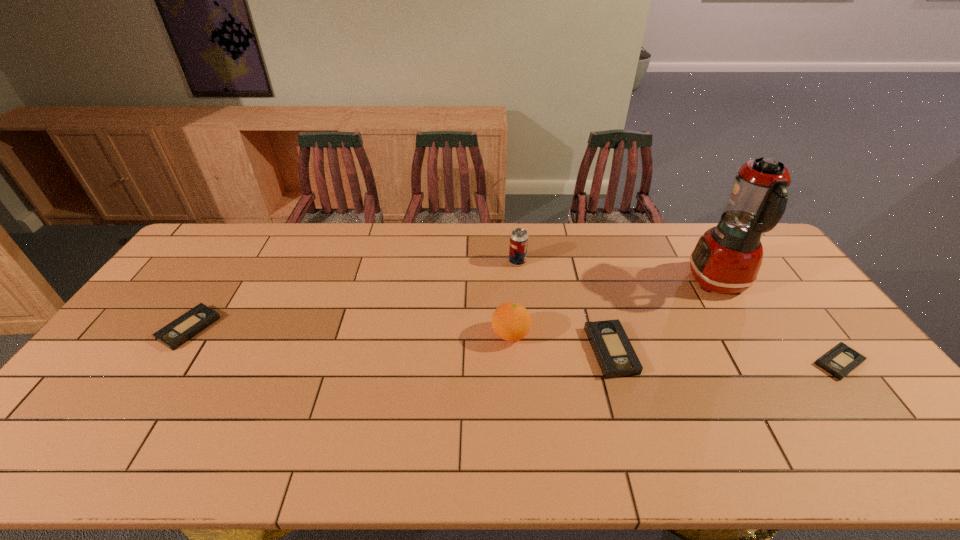
The width and height of the screenshot is (960, 540). What are the coordinates of `empty space that is in between the rightmost videotape and the orange` in the screenshot? It's located at (675, 348).

The height and width of the screenshot is (540, 960). In order to click on free area in between the food processor and the orange in this screenshot , I will do [614, 308].

Locate an element on the screen. This screenshot has height=540, width=960. vacant space that's between the fourth object from left to right and the shortest object is located at coordinates (725, 356).

This screenshot has height=540, width=960. I want to click on free space between the second videotape from right to left and the second shortest videotape, so click(x=400, y=339).

Identify the location of free space between the orange and the tallest videotape. (561, 342).

The height and width of the screenshot is (540, 960). What are the coordinates of `vacant point located between the orange and the beer can` in the screenshot? It's located at (514, 298).

What are the coordinates of `free area in between the tallest videotape and the shortest videotape` in the screenshot? It's located at (725, 356).

The image size is (960, 540). Identify the location of free space between the orange and the leftmost videotape. (349, 332).

You are a GUI agent. You are given a task and a screenshot of the screen. Output one action in this format:
    pyautogui.click(x=<x>, y=<y>)
    Task: Click on the object that is the second closest to the orange
    
    Given the screenshot: What is the action you would take?
    pyautogui.click(x=518, y=246)

The width and height of the screenshot is (960, 540). What are the coordinates of `the second closest object relative to the third shortest object` in the screenshot? It's located at (727, 258).